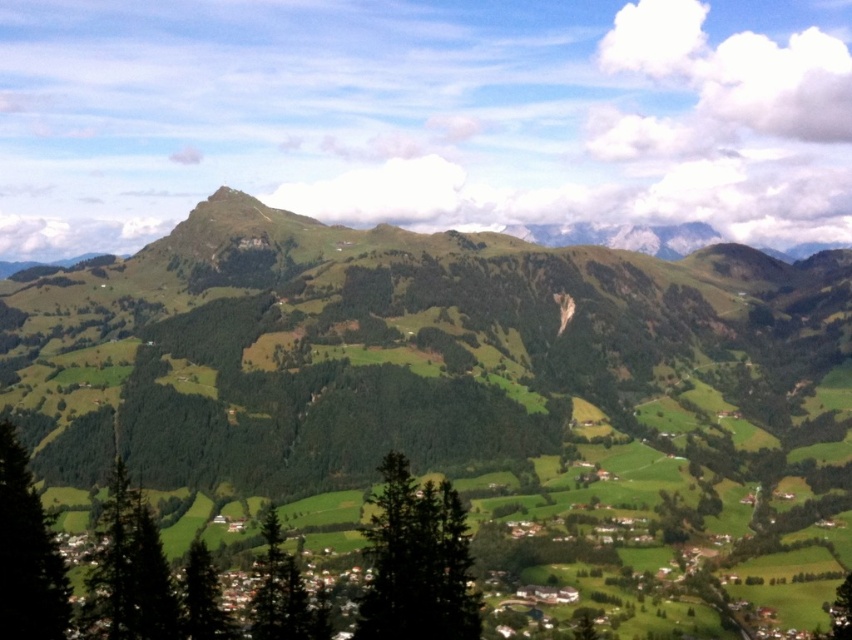
Question: In this image, where is green textured tree at center located relative to green matte tree at center?

Choices:
 (A) right
 (B) left

Answer: (A)

Question: Which point appears closest to the camera in this image?

Choices:
 (A) (770, 460)
 (B) (7, 580)

Answer: (B)

Question: Where is green textured tree at lower left located in relation to green matte tree at center in the image?

Choices:
 (A) left
 (B) right

Answer: (A)

Question: Which of the following is the closest to the observer?

Choices:
 (A) (1, 557)
 (B) (250, 634)

Answer: (A)

Question: Which object is farther from the camera taking this photo?

Choices:
 (A) green matte tree at lower left
 (B) green textured tree at center

Answer: (B)

Question: Can you confirm if green matte tree at lower left is positioned to the right of green matte tree at center?

Choices:
 (A) yes
 (B) no

Answer: (B)